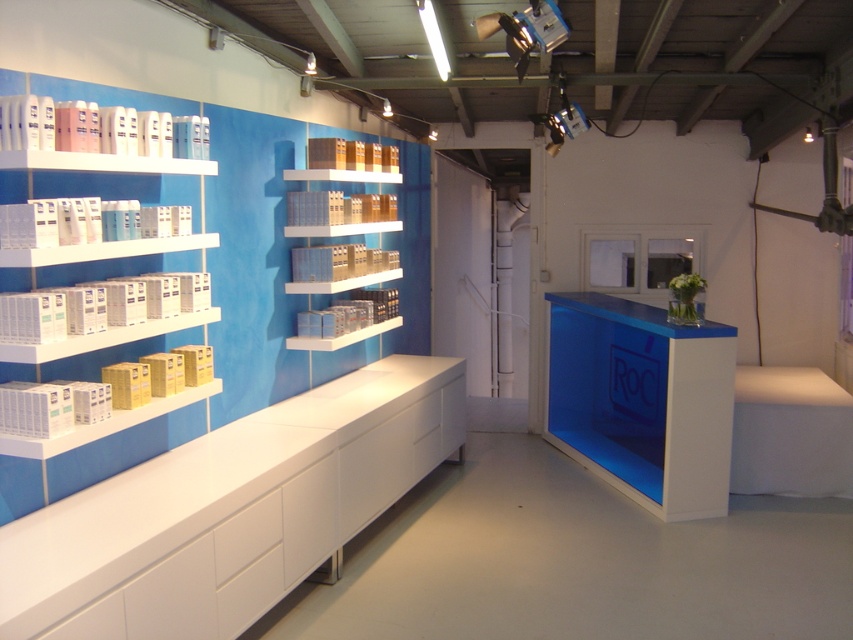
You are a customer entering the store and see the white glossy cabinet at lower left and the white glossy boxes at left. Which object is closer to the entrance?

The white glossy cabinet at lower left is closer to the entrance because it is in front of the white glossy boxes at left.

You are a customer entering the store and need to reach the blue glossy counter at center and the white glossy shelves at center. Which one is higher?

The blue glossy counter at center is much taller than the white glossy shelves at center.

You are a customer entering the store and want to ask the staff a question. You see the blue glossy counter at center and the white glossy shelves at center. Which one is closer to you?

The blue glossy counter at center and white glossy shelves at center are 6.18 feet apart, so you need to check your current position to determine which is closer. However, since both are at center, they might be equidistant from the entrance. Please provide more details about your location.